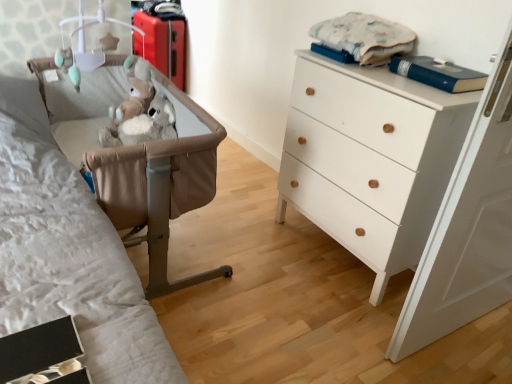
You are a GUI agent. You are given a task and a screenshot of the screen. Output one action in this format:
    pyautogui.click(x=<x>, y=<y>)
    Task: Click on the vacant space to the right of tan leather crib at left
    The height and width of the screenshot is (384, 512).
    Given the screenshot: What is the action you would take?
    pyautogui.click(x=266, y=271)